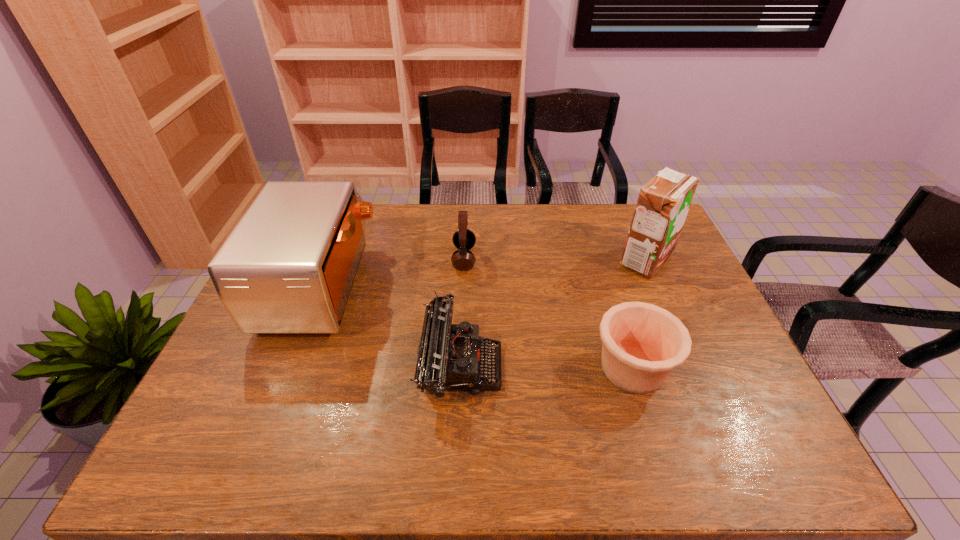
The image size is (960, 540). Find the location of `free space located on the back of the pottery`. free space located on the back of the pottery is located at coordinates (600, 265).

Locate an element on the screen. vacant space positioned on the keyboard of the typewriter is located at coordinates (564, 365).

At what (x,y) coordinates should I click in order to perform the action: click on carton situated at the far edge. Please return your answer as a coordinate pair (x, y). The width and height of the screenshot is (960, 540). Looking at the image, I should click on (663, 203).

Identify the location of toaster oven positioned at the far edge. (289, 265).

Identify the location of object that is at the left edge. Image resolution: width=960 pixels, height=540 pixels. (289, 265).

At what (x,y) coordinates should I click in order to perform the action: click on object located in the right edge section of the desktop. Please return your answer as a coordinate pair (x, y). Looking at the image, I should click on (663, 203).

Where is `object that is at the far left corner`? The height and width of the screenshot is (540, 960). object that is at the far left corner is located at coordinates (289, 265).

Image resolution: width=960 pixels, height=540 pixels. Identify the location of object at the far right corner. (663, 203).

In order to click on vacant space at the far edge in this screenshot , I will do (x=522, y=242).

Where is `vacant space at the near edge`? Image resolution: width=960 pixels, height=540 pixels. vacant space at the near edge is located at coordinates (647, 465).